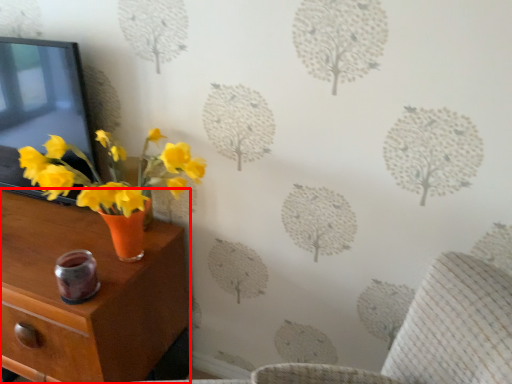
Question: In this image, where is nightstand (annotated by the red box) located relative to picture frame?

Choices:
 (A) left
 (B) right

Answer: (A)